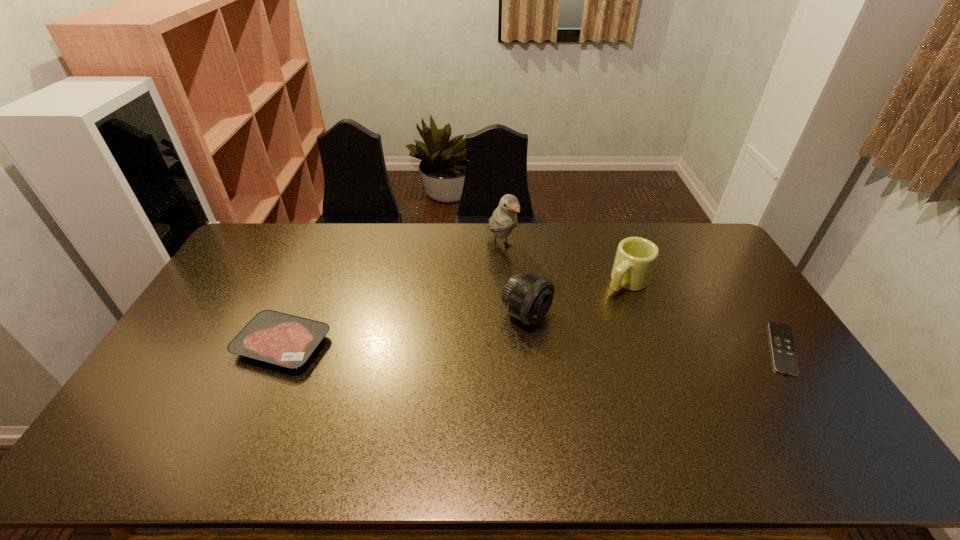
Where is `free spot on the desktop that is between the second shortest object and the shortest object and is positioned at the face of the farthest object`? The height and width of the screenshot is (540, 960). free spot on the desktop that is between the second shortest object and the shortest object and is positioned at the face of the farthest object is located at coordinates (582, 347).

This screenshot has height=540, width=960. I want to click on vacant space on the desktop that is between the leftmost object and the shortest object and is positioned with the handle on the side of the fourth object from left to right, so click(x=560, y=347).

Identify the location of vacant space on the desktop that is between the steak and the rightmost object and is positioned on the front-facing side of the telephoto lens. (585, 347).